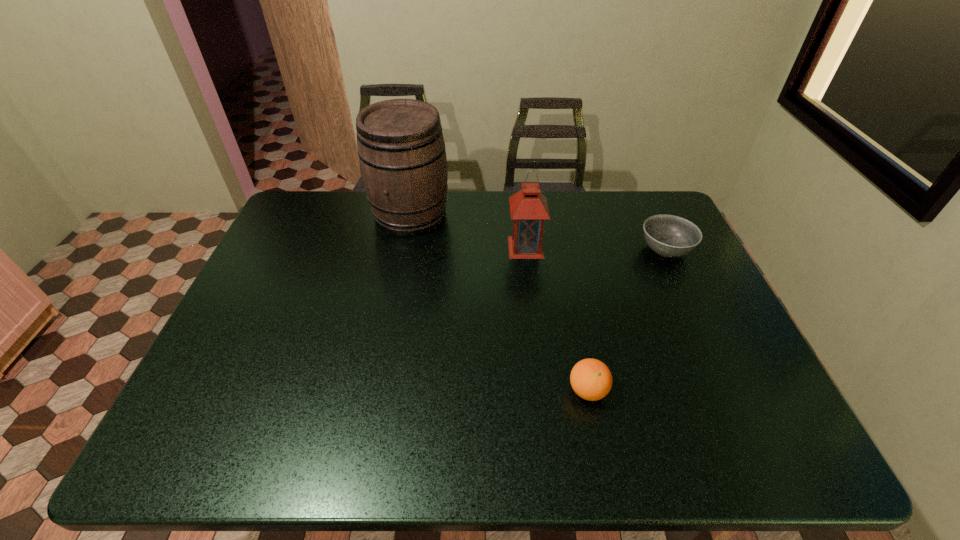
You are a GUI agent. You are given a task and a screenshot of the screen. Output one action in this format:
    pyautogui.click(x=<x>, y=<y>)
    Task: Click on the tallest object
    This screenshot has height=540, width=960.
    Given the screenshot: What is the action you would take?
    pyautogui.click(x=401, y=148)

The image size is (960, 540). I want to click on the leftmost object, so click(401, 148).

Locate an element on the screen. the second object from left to right is located at coordinates (528, 207).

Where is `lantern`? The height and width of the screenshot is (540, 960). lantern is located at coordinates (528, 207).

The height and width of the screenshot is (540, 960). What are the coordinates of `orange` in the screenshot? It's located at (591, 379).

Find the location of a particular element. the nearest object is located at coordinates (591, 379).

What are the coordinates of `the rightmost object` in the screenshot? It's located at (667, 235).

The image size is (960, 540). Identify the location of vacant space positioned on the front of the leftmost object. (397, 284).

At what (x,y) coordinates should I click in order to perform the action: click on free spot located 0.240m on the back of the third object from right to left. Please return your answer as a coordinate pair (x, y). The width and height of the screenshot is (960, 540). Looking at the image, I should click on (519, 194).

This screenshot has height=540, width=960. Identify the location of vacant space located on the back of the orange. (571, 308).